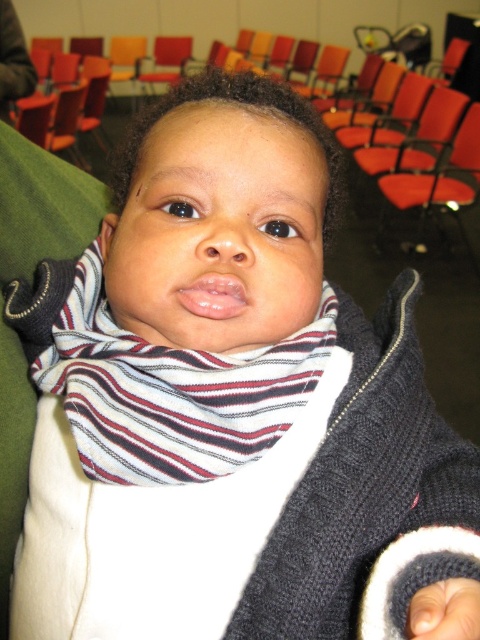
You are organizing a small event in a room with chairs arranged in neat rows. You notice the white striped scarf at center and the orange fabric chair at right. Which object is shorter in height?

The white striped scarf at center is not as tall as the orange fabric chair at right, so the white striped scarf at center is shorter in height.